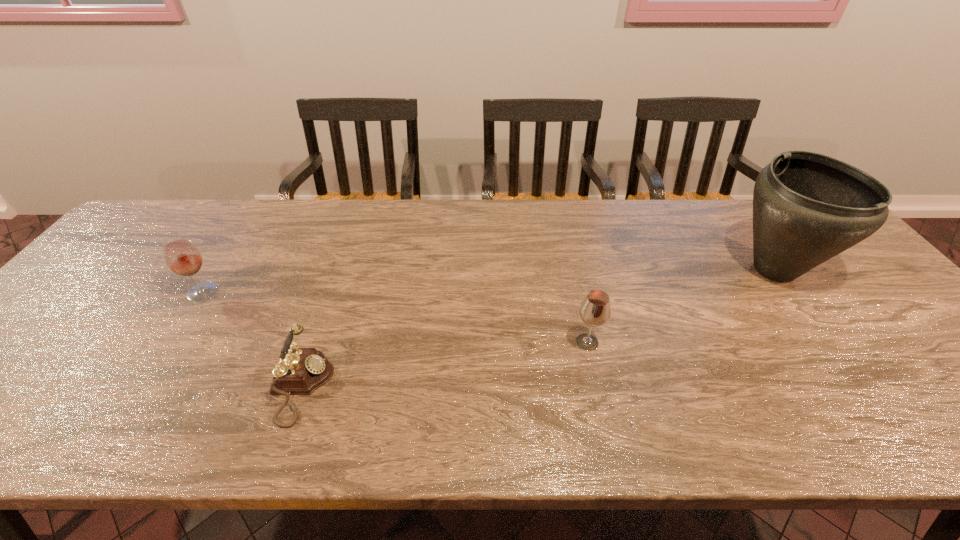
You are a GUI agent. You are given a task and a screenshot of the screen. Output one action in this format:
    pyautogui.click(x=<x>, y=<y>)
    Task: Click on the free space between the right wineglass and the shortest object
    This screenshot has height=540, width=960.
    Given the screenshot: What is the action you would take?
    pyautogui.click(x=444, y=364)

What are the coordinates of `vacant space in between the left wineglass and the nearer wineglass` in the screenshot? It's located at (396, 317).

Where is `vacant space that is in between the leftmost object and the third object from right to left`? The width and height of the screenshot is (960, 540). vacant space that is in between the leftmost object and the third object from right to left is located at coordinates (252, 339).

Where is `free space between the urn and the right wineglass`? free space between the urn and the right wineglass is located at coordinates (681, 306).

You are a GUI agent. You are given a task and a screenshot of the screen. Output one action in this format:
    pyautogui.click(x=<x>, y=<y>)
    Task: Click on the unoccupied position between the second object from right to left and the urn
    The width and height of the screenshot is (960, 540).
    Given the screenshot: What is the action you would take?
    coord(681,306)

This screenshot has height=540, width=960. What are the coordinates of `vacant space in between the second object from right to left and the left wineglass` in the screenshot? It's located at (396, 317).

Locate an element on the screen. This screenshot has width=960, height=540. vacant space that's between the left wineglass and the shortest object is located at coordinates (252, 339).

The width and height of the screenshot is (960, 540). Identify the location of free area in between the tallest object and the third object from left to right. (681, 306).

This screenshot has width=960, height=540. In order to click on vacant point located between the telephone and the nearer wineglass in this screenshot , I will do `click(444, 364)`.

This screenshot has height=540, width=960. I want to click on the third closest object relative to the leftmost object, so click(807, 207).